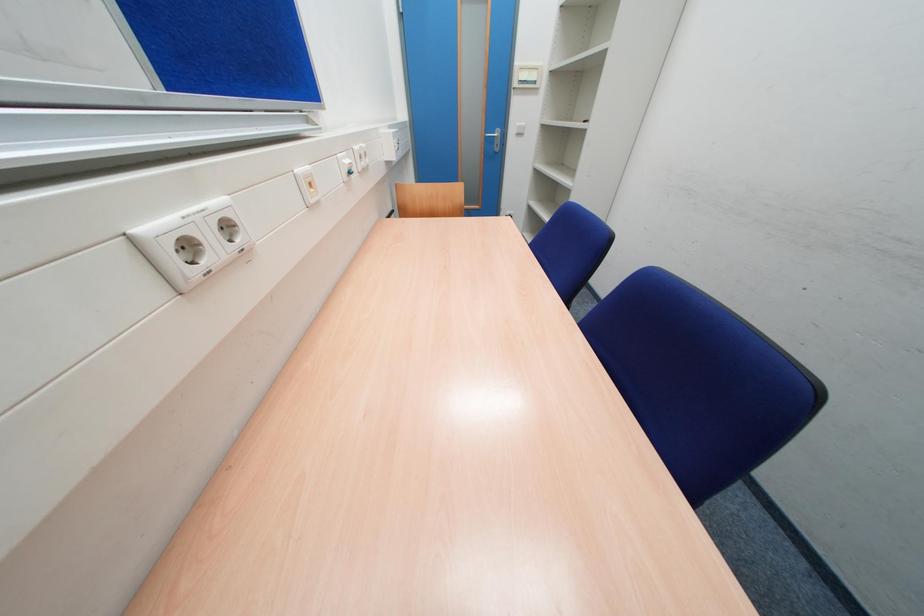
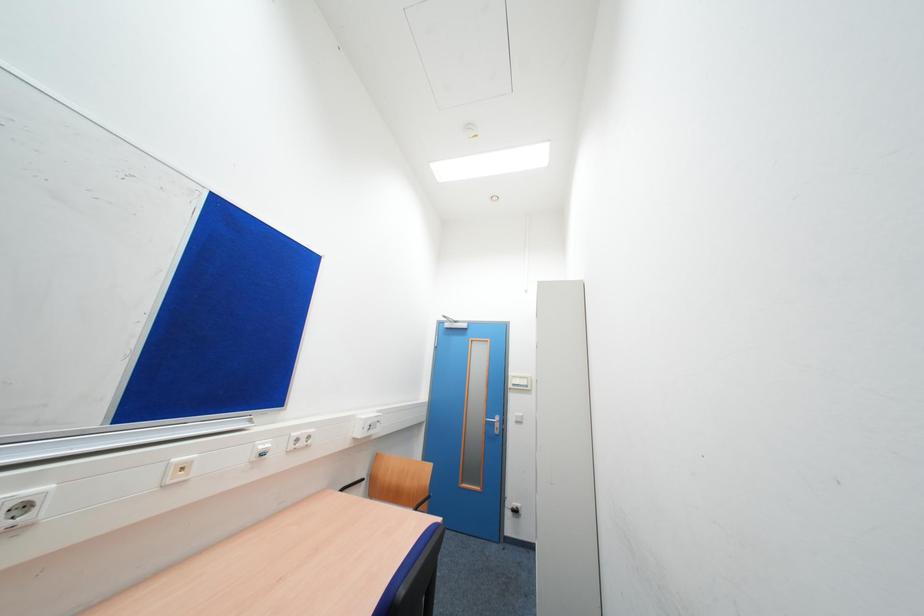
From the picture: First-person continuous shooting, in which direction is the camera rotating?

The rotation direction of the camera is left-up.